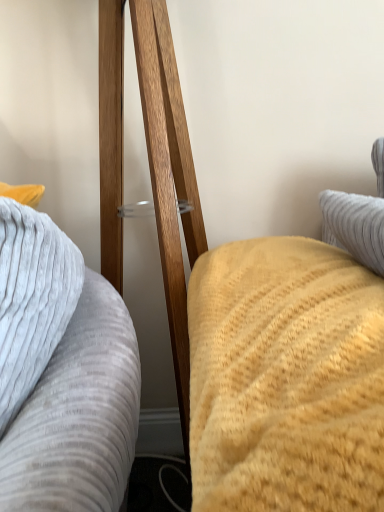
Question: From a real-world perspective, is yellow textured blanket at right, which is counted as the 2th furniture, starting from the left, physically located above or below gray textured pillow at left, positioned as the second furniture in right-to-left order?

Choices:
 (A) above
 (B) below

Answer: (A)

Question: From their relative heights in the image, would you say yellow textured blanket at right, acting as the 1th furniture starting from the right, is taller or shorter than gray textured pillow at left, which is the 1th furniture from left to right?

Choices:
 (A) tall
 (B) short

Answer: (B)

Question: Looking at their shapes, would you say yellow textured blanket at right, which is counted as the 2th furniture, starting from the left, is wider or thinner than gray textured pillow at left, which is the 1th furniture from left to right?

Choices:
 (A) thin
 (B) wide

Answer: (B)

Question: Choose the correct answer: Is gray textured pillow at left, which is the 1th furniture from left to right, inside yellow textured blanket at right, acting as the 1th furniture starting from the right, or outside it?

Choices:
 (A) inside
 (B) outside

Answer: (B)

Question: Is point (122, 450) positioned closer to the camera than point (99, 143)?

Choices:
 (A) farther
 (B) closer

Answer: (B)

Question: Is gray textured pillow at left, positioned as the second furniture in right-to-left order, wider or thinner than yellow textured blanket at right, acting as the 1th furniture starting from the right?

Choices:
 (A) wide
 (B) thin

Answer: (B)

Question: Based on their positions, is gray textured pillow at left, positioned as the second furniture in right-to-left order, located to the left or right of yellow textured blanket at right, acting as the 1th furniture starting from the right?

Choices:
 (A) right
 (B) left

Answer: (B)